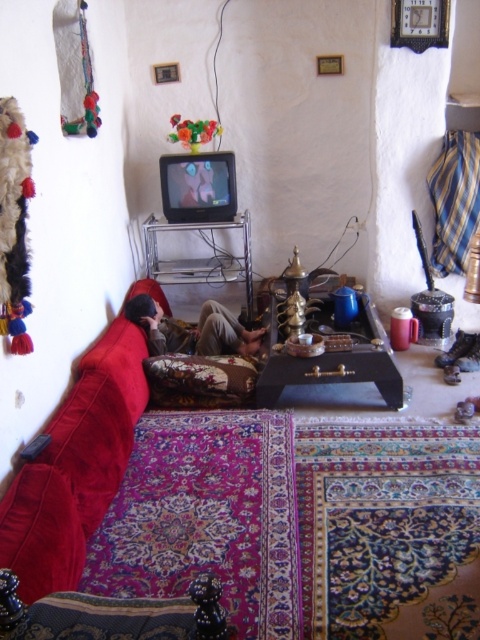
Question: Which point appears closest to the camera in this image?

Choices:
 (A) (212, 360)
 (B) (119, 483)

Answer: (B)

Question: Which of the following is the closest to the observer?

Choices:
 (A) floral fabric pillow at center
 (B) matte brown person at center
 (C) velvet red couch at lower left

Answer: (C)

Question: Which object is closer to the camera taking this photo?

Choices:
 (A) matte brown person at center
 (B) velvet red couch at lower left

Answer: (B)

Question: Is floral fabric pillow at center smaller than matte brown person at center?

Choices:
 (A) yes
 (B) no

Answer: (A)

Question: Can you confirm if velvet red couch at lower left is positioned to the left of floral fabric pillow at center?

Choices:
 (A) yes
 (B) no

Answer: (A)

Question: From the image, what is the correct spatial relationship of velvet red couch at lower left in relation to floral fabric pillow at center?

Choices:
 (A) above
 (B) below

Answer: (B)